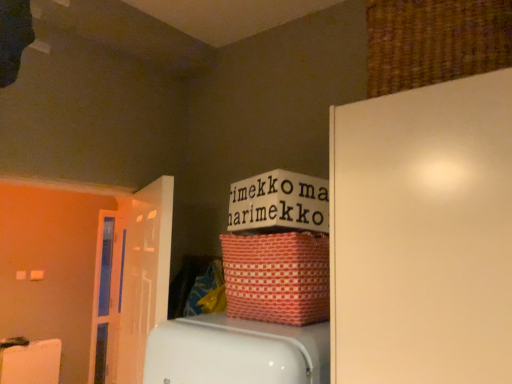
Question: Can you confirm if white glossy door at left, the first door positioned from the right, is positioned to the right of woven brown basket at upper right, arranged as the 1th basket when viewed from the top?

Choices:
 (A) yes
 (B) no

Answer: (B)

Question: Is white glossy door at left, the 1th door positioned from the front, aimed at woven brown basket at upper right, arranged as the 1th basket when viewed from the top?

Choices:
 (A) no
 (B) yes

Answer: (A)

Question: Does white glossy door at left, the first door positioned from the right, lie behind woven brown basket at upper right, which is the 2th basket from left to right?

Choices:
 (A) yes
 (B) no

Answer: (A)

Question: Is white glossy door at left, acting as the second door starting from the left, far away from woven brown basket at upper right, arranged as the 1th basket when viewed from the top?

Choices:
 (A) yes
 (B) no

Answer: (A)

Question: From the image's perspective, is white glossy door at left, acting as the second door starting from the left, located above woven brown basket at upper right, which is the 2th basket from left to right?

Choices:
 (A) yes
 (B) no

Answer: (B)

Question: Does point (312, 268) appear closer or farther from the camera than point (100, 223)?

Choices:
 (A) farther
 (B) closer

Answer: (B)

Question: Is red woven basket at upper center, placed as the 1th basket when sorted from bottom to top, inside the boundaries of transparent glass door at left, positioned as the 1th door in back-to-front order, or outside?

Choices:
 (A) outside
 (B) inside

Answer: (A)

Question: Visually, is red woven basket at upper center, placed as the 1th basket when sorted from bottom to top, positioned to the left or to the right of transparent glass door at left, positioned as the 1th door in back-to-front order?

Choices:
 (A) left
 (B) right

Answer: (B)

Question: From the image's perspective, relative to transparent glass door at left, the 2th door in the right-to-left sequence, is red woven basket at upper center, placed as the 1th basket when sorted from bottom to top, above or below?

Choices:
 (A) below
 (B) above

Answer: (B)

Question: From the image's perspective, is woven brown basket at upper right, which is the 2th basket from left to right, located above or below red woven basket at upper center, the first basket from the left?

Choices:
 (A) below
 (B) above

Answer: (B)

Question: Is woven brown basket at upper right, the 1th basket positioned from the right, spatially inside red woven basket at upper center, placed as the 1th basket when sorted from bottom to top, or outside of it?

Choices:
 (A) outside
 (B) inside

Answer: (A)

Question: Would you say woven brown basket at upper right, placed as the second basket when sorted from bottom to top, is to the left or to the right of red woven basket at upper center, placed as the 1th basket when sorted from bottom to top, in the picture?

Choices:
 (A) left
 (B) right

Answer: (B)

Question: Considering their positions, is woven brown basket at upper right, the 1th basket positioned from the right, located in front of or behind red woven basket at upper center, placed as the 1th basket when sorted from bottom to top?

Choices:
 (A) behind
 (B) front

Answer: (B)

Question: In terms of size, does transparent glass door at left, positioned as the 1th door in back-to-front order, appear bigger or smaller than red woven basket at upper center, placed as the 1th basket when sorted from bottom to top?

Choices:
 (A) big
 (B) small

Answer: (B)

Question: Looking at their shapes, would you say transparent glass door at left, which is the second door from front to back, is wider or thinner than red woven basket at upper center, the first basket from the left?

Choices:
 (A) thin
 (B) wide

Answer: (A)